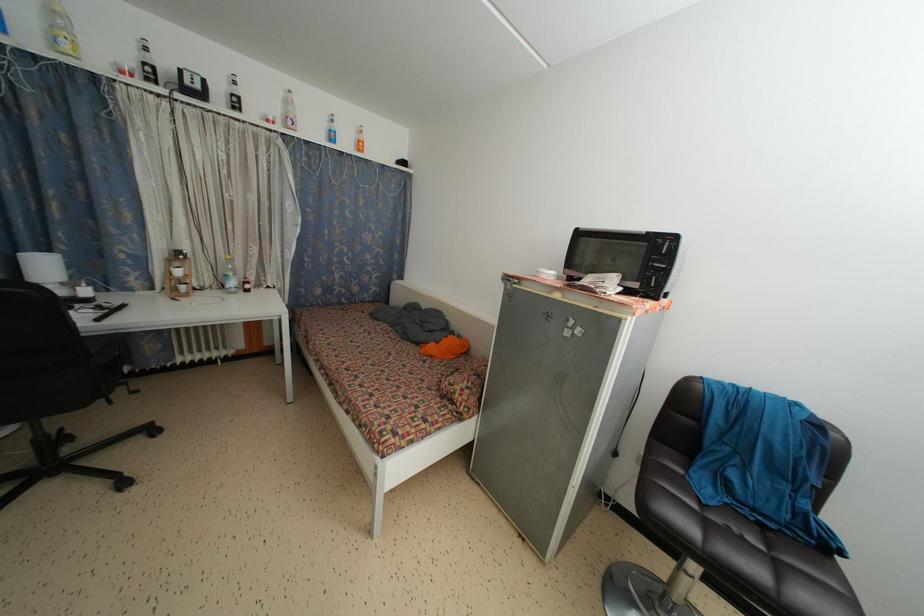
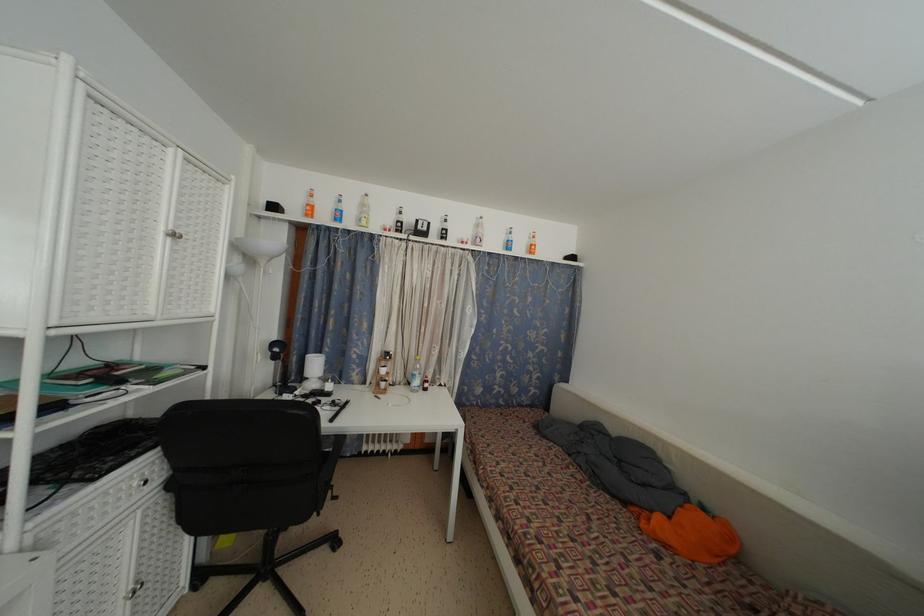
Where in the second image is the point corresponding to pixel 237 289 from the first image?

(420, 387)